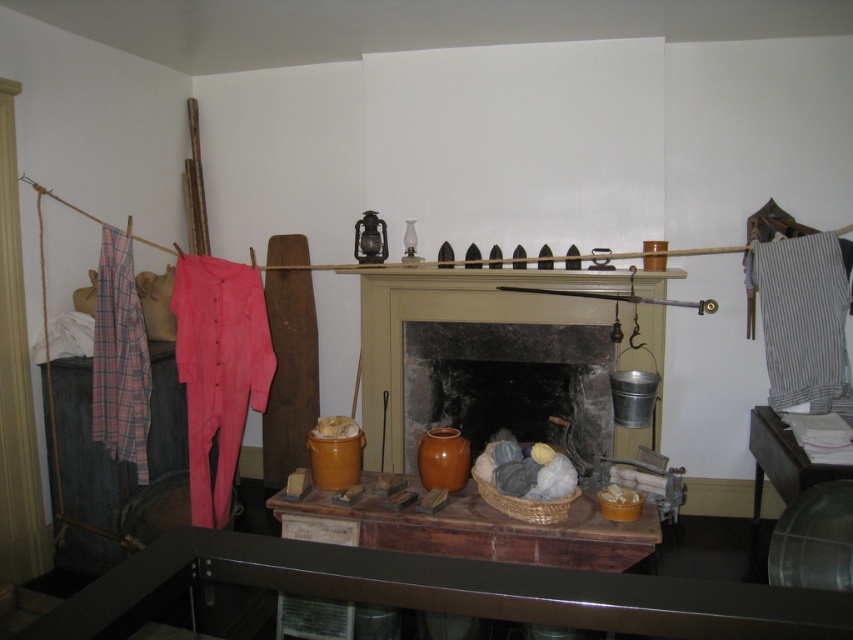
Is dark gray stone fireplace at center wider than gray striped fabric at right?

Yes, dark gray stone fireplace at center is wider than gray striped fabric at right.

This screenshot has width=853, height=640. What are the coordinates of `dark gray stone fireplace at center` in the screenshot? It's located at (508, 385).

Consider the image. Between plaid cotton pants at left and white paper at lower right, which one is positioned lower?

white paper at lower right is lower down.

Can you confirm if plaid cotton pants at left is bigger than white paper at lower right?

No.

Between point (144, 451) and point (787, 435), which one is positioned behind?

The point (787, 435) is behind.

At what (x,y) coordinates should I click in order to perform the action: click on plaid cotton pants at left. Please return your answer as a coordinate pair (x, y). The width and height of the screenshot is (853, 640). Looking at the image, I should click on (119, 356).

How far apart are dark gray stone fireplace at center and white paper at lower right?

A distance of 1.00 meters exists between dark gray stone fireplace at center and white paper at lower right.

Can you confirm if dark gray stone fireplace at center is positioned below white paper at lower right?

Incorrect, dark gray stone fireplace at center is not positioned below white paper at lower right.

Where is `dark gray stone fireplace at center`? dark gray stone fireplace at center is located at coordinates (508, 385).